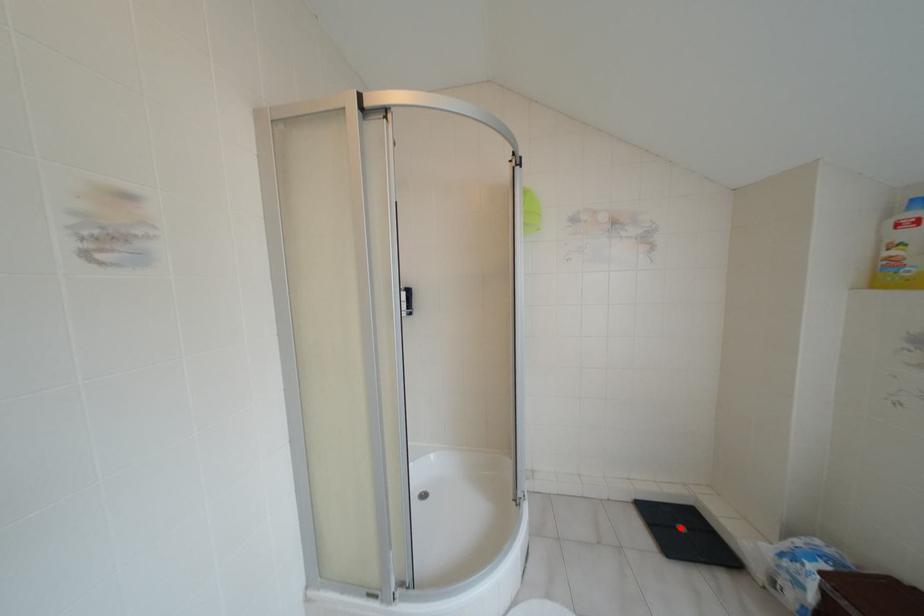
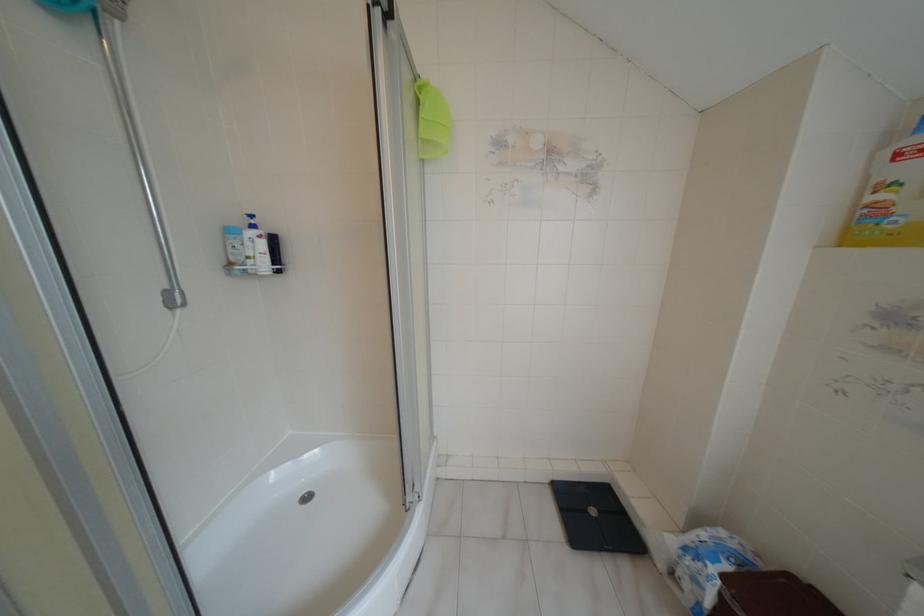
Find the pixel in the second image that matches the highlighted location in the first image.

(591, 511)